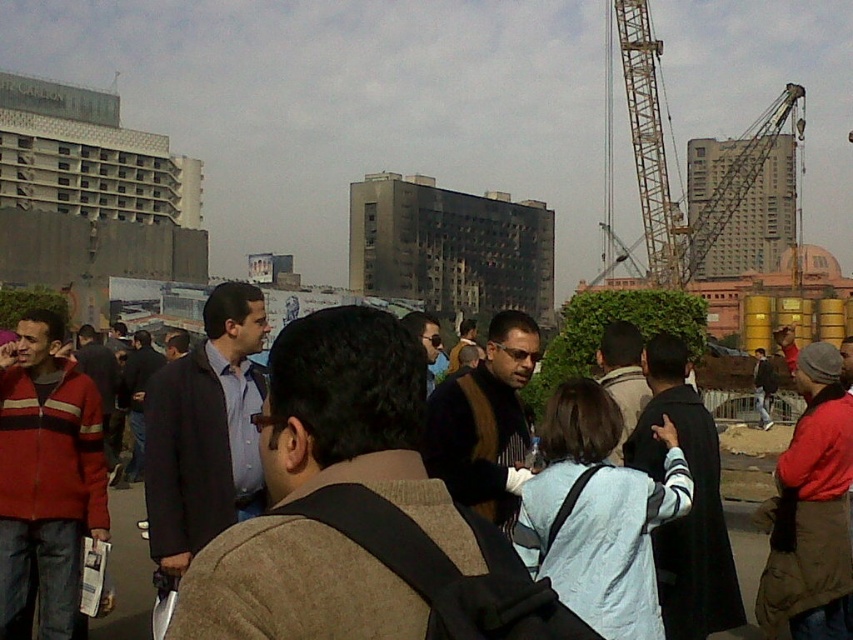
Question: Does metallic gray crane at upper right appear over light brown jacket at center?

Choices:
 (A) yes
 (B) no

Answer: (A)

Question: Estimate the real-world distances between objects in this image. Which object is farther from the dark blue shirt at center?

Choices:
 (A) red fleece jacket at left
 (B) light brown jacket at center
 (C) metallic gray crane at upper right

Answer: (C)

Question: Is red fleece jacket at left closer to the viewer compared to metallic gray crane at upper right?

Choices:
 (A) yes
 (B) no

Answer: (A)

Question: In this image, where is red fleece jacket at left located relative to light brown jacket at center?

Choices:
 (A) below
 (B) above

Answer: (A)

Question: Which is farther from the light brown jacket at center?

Choices:
 (A) dark blue shirt at center
 (B) metallic gray crane at upper right
 (C) red fleece jacket at left

Answer: (B)

Question: Which object is the closest to the red fleece jacket at left?

Choices:
 (A) light brown jacket at center
 (B) metallic gray crane at upper right

Answer: (A)